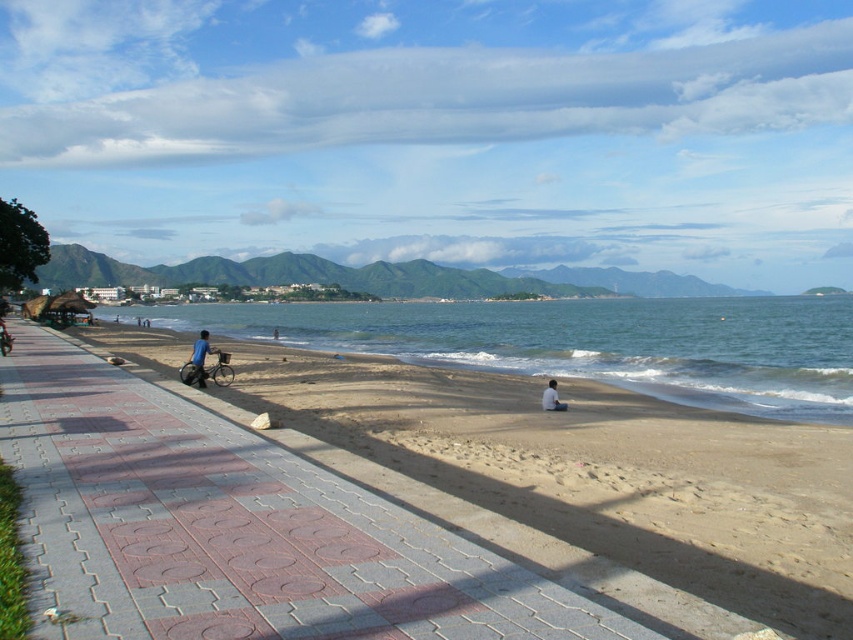
Is point (485, 369) less distant than point (552, 394)?

No, it is not.

Who is more distant from viewer, [189,305] or [543,396]?

The point [189,305] is behind.

The height and width of the screenshot is (640, 853). I want to click on greenish-blue water at center, so click(x=585, y=342).

Does greenish-blue water at center lie behind blue fabric shirt at center?

Yes, it is behind blue fabric shirt at center.

Between greenish-blue water at center and blue fabric shirt at center, which one appears on the right side from the viewer's perspective?

greenish-blue water at center

The image size is (853, 640). What do you see at coordinates (585, 342) in the screenshot? I see `greenish-blue water at center` at bounding box center [585, 342].

Locate an element on the screen. Image resolution: width=853 pixels, height=640 pixels. greenish-blue water at center is located at coordinates (585, 342).

Is blue fabric shirt at center further to the viewer compared to light brown sand at lower center?

Yes, it is.

In the scene shown: Between blue fabric shirt at center and light brown sand at lower center, which one appears on the left side from the viewer's perspective?

Positioned to the left is blue fabric shirt at center.

Between point (199, 333) and point (543, 406), which one is positioned in front?

Point (543, 406)

Locate an element on the screen. The width and height of the screenshot is (853, 640). blue fabric shirt at center is located at coordinates (198, 360).